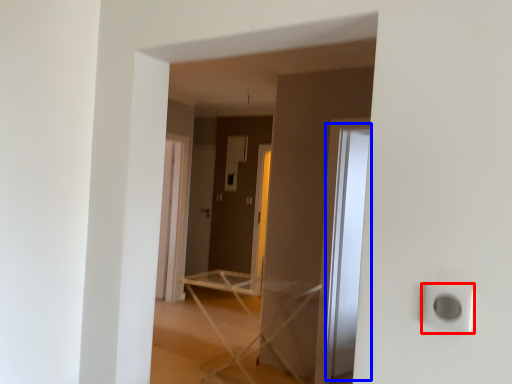
Question: Which of the following is the closest to the observer, electric outlet (highlighted by a red box) or glass door (highlighted by a blue box)?

Choices:
 (A) electric outlet
 (B) glass door

Answer: (A)